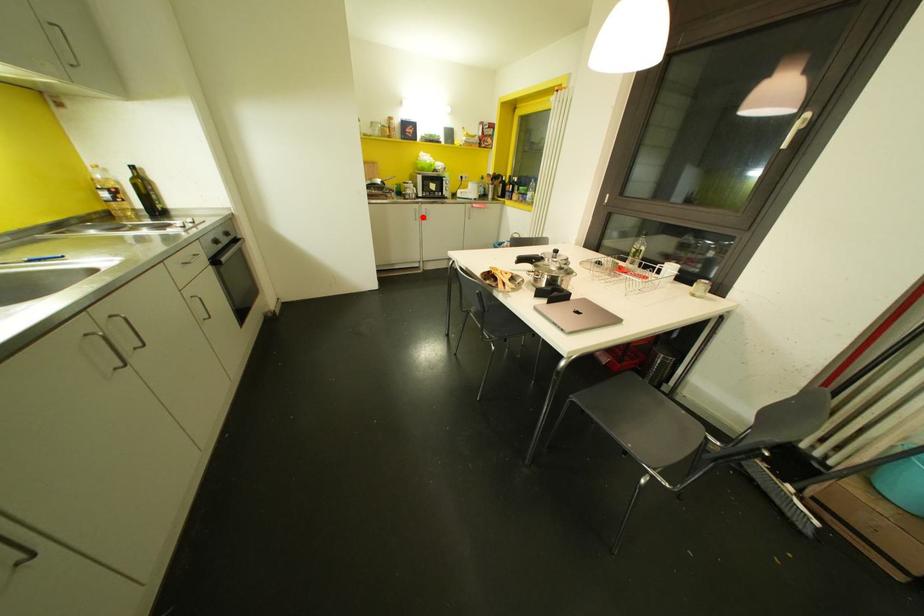
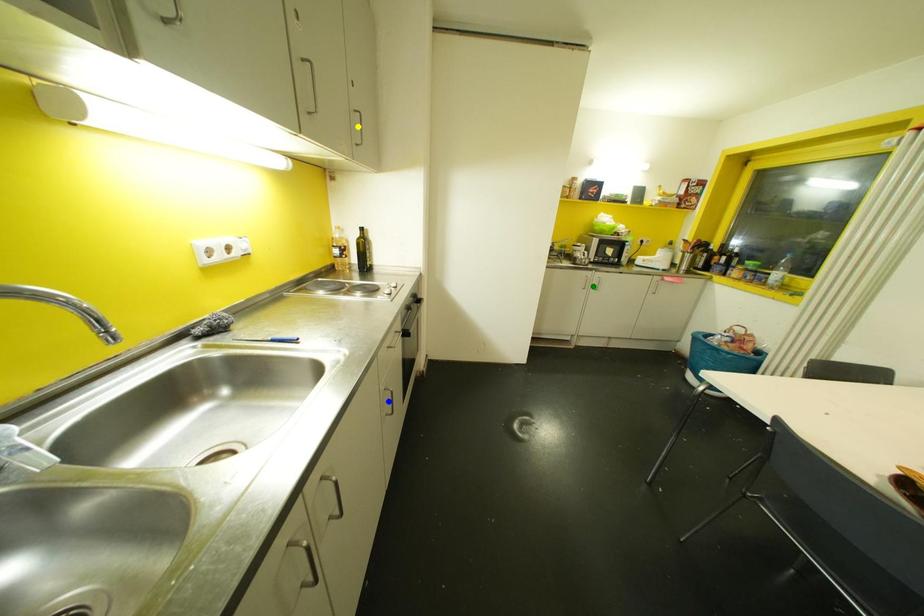
Question: I am providing you with two images of the same scene from different viewpoints. A red point is marked on the first image. You are given multiple points on the second image. Which mark in image 2 goes with the point in image 1?

Choices:
 (A) yellow point
 (B) green point
 (C) blue point

Answer: (B)